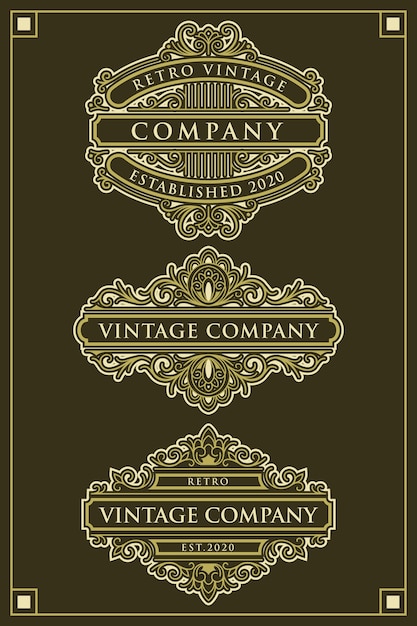
Where is `scrollwork`? This screenshot has height=626, width=417. scrollwork is located at coordinates (214, 577), (216, 397), (213, 208), (203, 38).